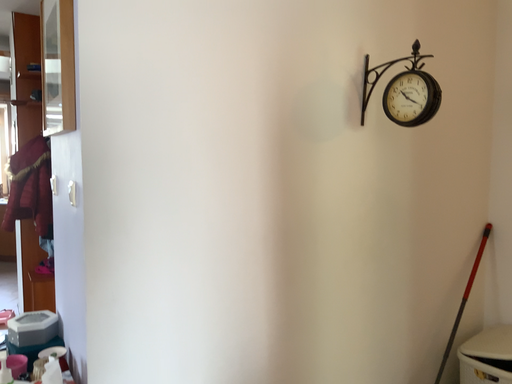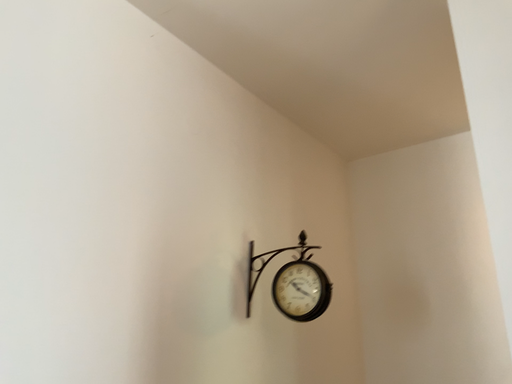
Question: How did the camera likely rotate when shooting the video?

Choices:
 (A) rotated downward
 (B) rotated upward

Answer: (B)